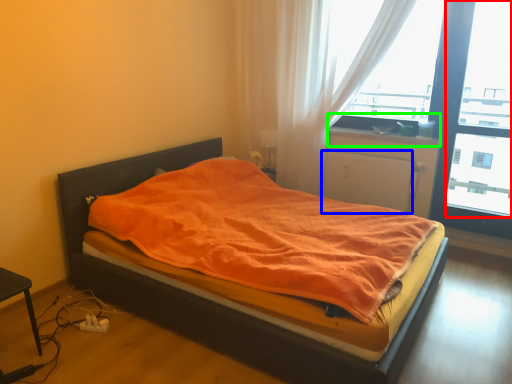
Question: Based on their relative distances, which object is farther from window screen (highlighted by a red box)? Choose from screen door (highlighted by a blue box) and window sill (highlighted by a green box).

Choices:
 (A) screen door
 (B) window sill

Answer: (B)